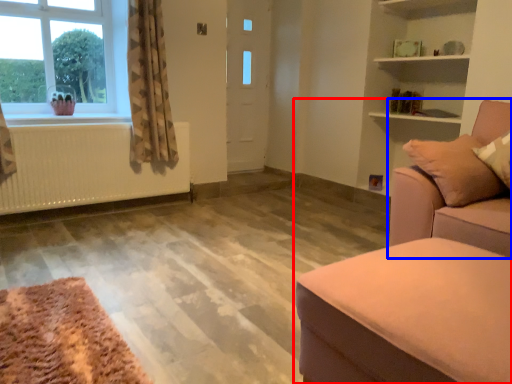
Question: Among these objects, which one is nearest to the camera, studio couch (highlighted by a red box) or studio couch (highlighted by a blue box)?

Choices:
 (A) studio couch
 (B) studio couch

Answer: (A)